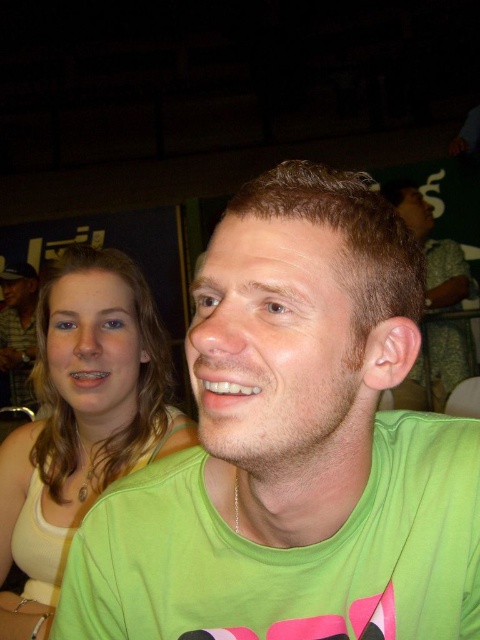
You are standing at the point labeled point [80,627] and want to walk towards the point labeled point [16,365]. Given that both points are in the image, which direction should you move relative to your current position?

Since point [80,627] is closer to the camera than point [16,365], you should move backward to reach point [16,365] from your current position at point [80,627].